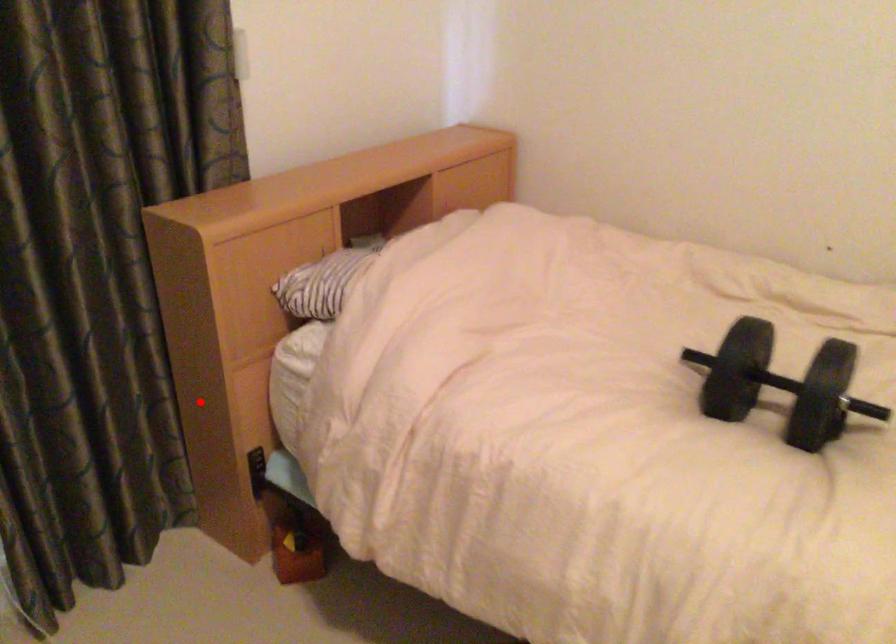
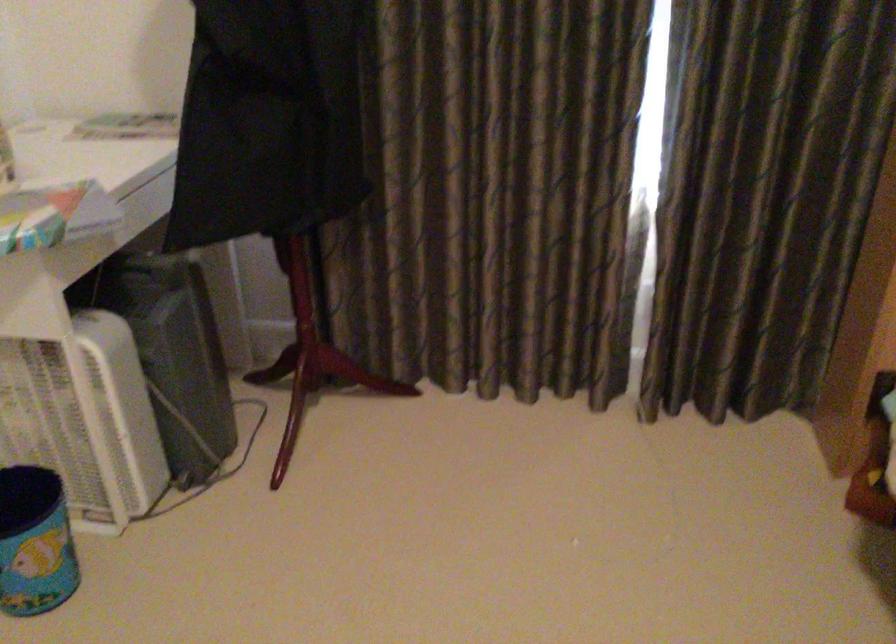
Locate, in the second image, the point that corresponds to the highlighted location in the first image.

(865, 298)